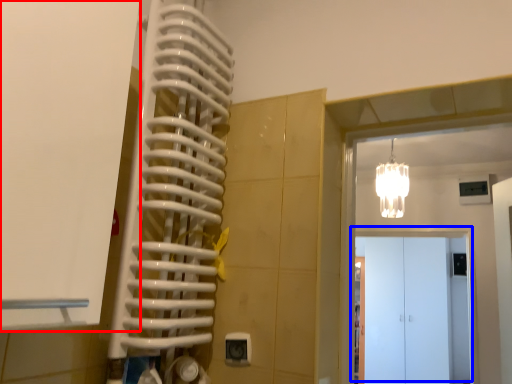
Question: Which of the following is the closest to the observer, door (highlighted by a red box) or door (highlighted by a blue box)?

Choices:
 (A) door
 (B) door

Answer: (A)